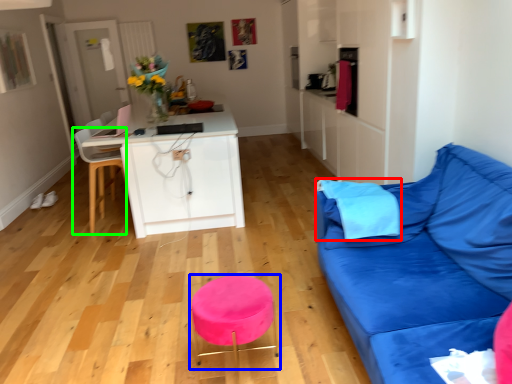
Question: Which object is positioned closest to pillow (highlighted by a red box)? Select from bar stool (highlighted by a blue box) and chair (highlighted by a green box).

Choices:
 (A) bar stool
 (B) chair

Answer: (A)